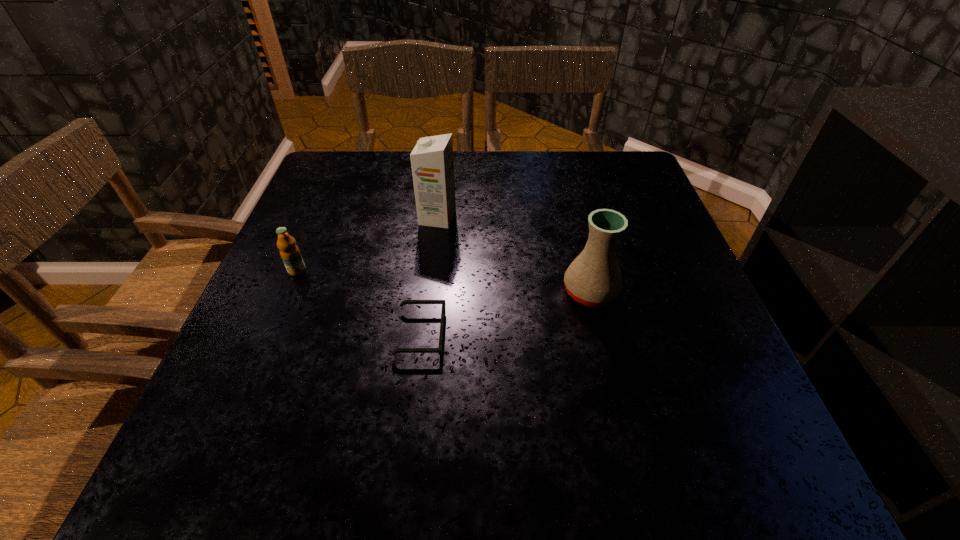
Find the location of `free space between the carton and the orange juice`. free space between the carton and the orange juice is located at coordinates (368, 244).

What are the coordinates of `free point between the leftmost object and the pottery` in the screenshot? It's located at (444, 281).

Identify the location of free space between the shortest object and the rightmost object. (505, 313).

This screenshot has width=960, height=540. I want to click on vacant region between the sunglasses and the pottery, so click(x=505, y=313).

At what (x,y) coordinates should I click in order to perform the action: click on free space between the carton and the pottery. Please return your answer as a coordinate pair (x, y). Looking at the image, I should click on (514, 255).

Find the location of a particular element. This screenshot has width=960, height=540. free spot between the sunglasses and the pottery is located at coordinates (505, 313).

Identify the location of object that is the nearest to the farthest object. This screenshot has height=540, width=960. (439, 350).

This screenshot has height=540, width=960. Find the location of `the second closest object to the shortest object`. the second closest object to the shortest object is located at coordinates (289, 251).

I want to click on vacant space that satisfies the following two spatial constraints: 1. on the front side of the pottery; 2. on the front-facing side of the sunglasses, so click(x=600, y=334).

In order to click on vacant space that satisfies the following two spatial constraints: 1. on the front side of the carton; 2. on the front-facing side of the sunglasses in this screenshot , I will do `click(424, 334)`.